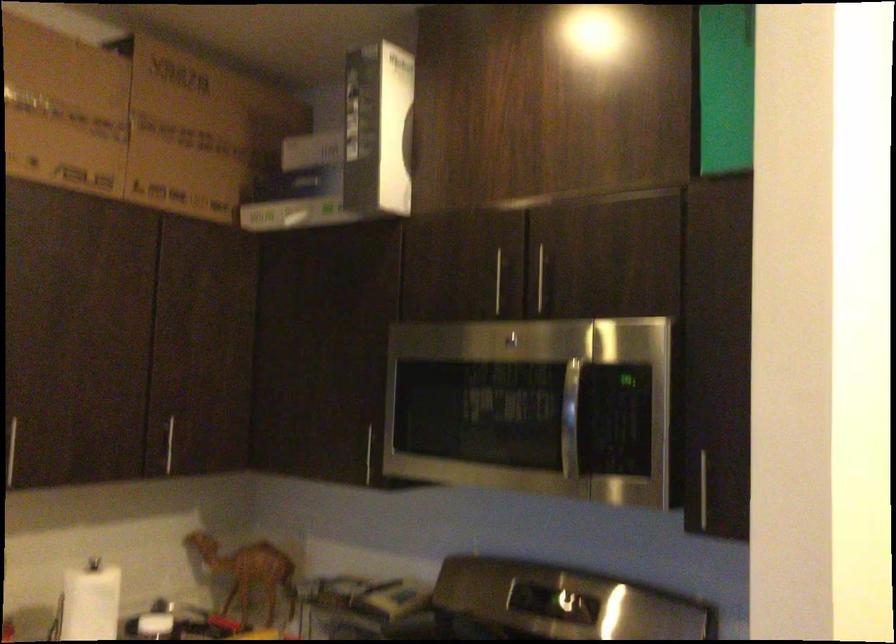
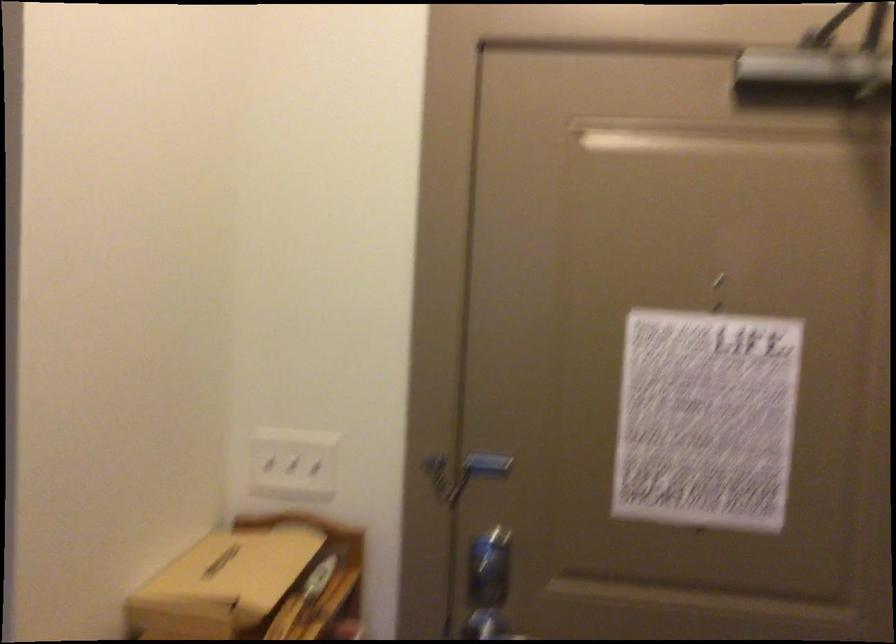
Question: Based on the continuous images, in which direction is the camera rotating? Reply with the corresponding letter.

Choices:
 (A) Left
 (B) Right
 (C) Up
 (D) Down

Answer: (B)